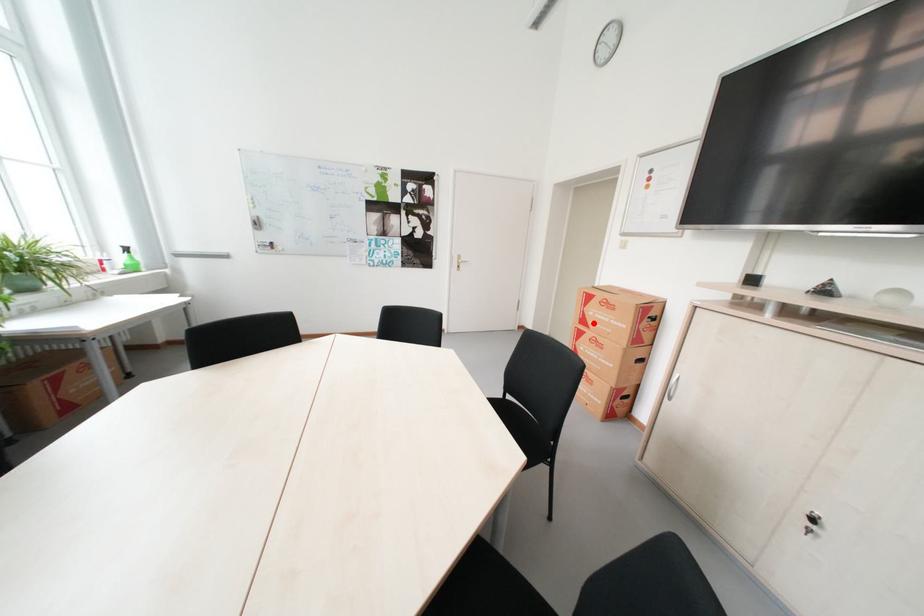
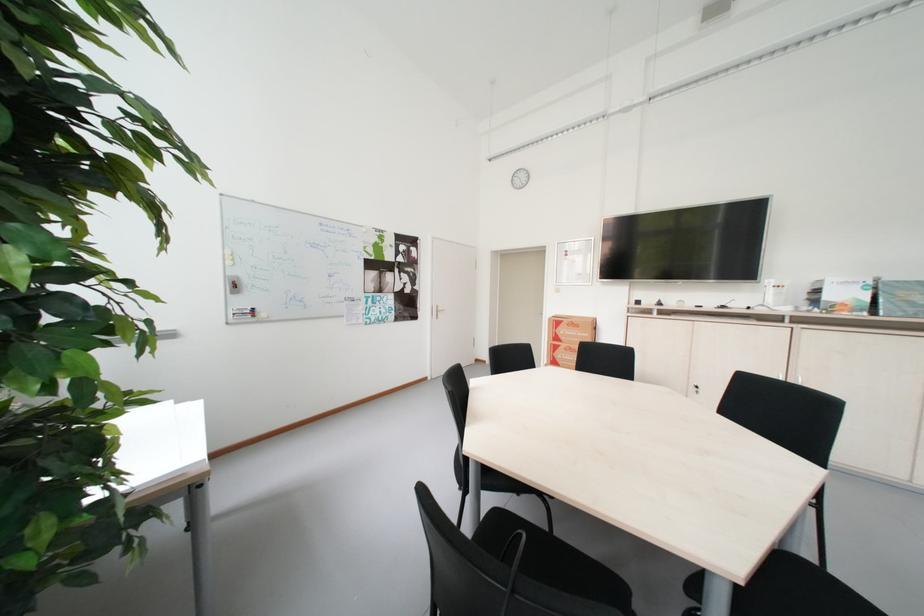
Question: I am providing you with two images of the same scene from different viewpoints. In image1, a red point is highlighted. Considering the same 3D point in image2, which of the following is correct?

Choices:
 (A) It is closer
 (B) It is farther

Answer: (B)